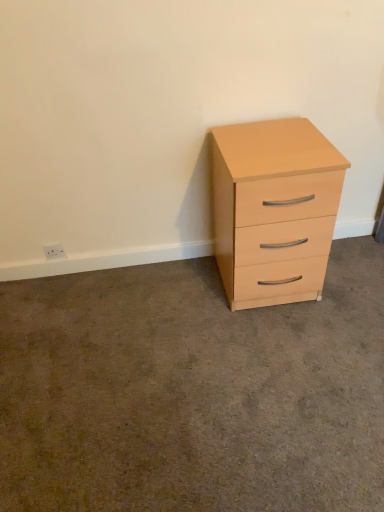
Question: Is white plastic electric outlet at lower left to the left of matte wood chest of drawers at right from the viewer's perspective?

Choices:
 (A) no
 (B) yes

Answer: (B)

Question: Is white plastic electric outlet at lower left shorter than matte wood chest of drawers at right?

Choices:
 (A) no
 (B) yes

Answer: (B)

Question: Can you confirm if white plastic electric outlet at lower left is taller than matte wood chest of drawers at right?

Choices:
 (A) no
 (B) yes

Answer: (A)

Question: Does white plastic electric outlet at lower left appear on the right side of matte wood chest of drawers at right?

Choices:
 (A) no
 (B) yes

Answer: (A)

Question: Are white plastic electric outlet at lower left and matte wood chest of drawers at right far apart?

Choices:
 (A) yes
 (B) no

Answer: (A)

Question: Is white plastic electric outlet at lower left inside or outside of matte wood cabinet at right?

Choices:
 (A) outside
 (B) inside

Answer: (A)

Question: From the image's perspective, is white plastic electric outlet at lower left above or below matte wood cabinet at right?

Choices:
 (A) above
 (B) below

Answer: (A)

Question: Is white plastic electric outlet at lower left wider or thinner than matte wood cabinet at right?

Choices:
 (A) wide
 (B) thin

Answer: (B)

Question: In the image, is white plastic electric outlet at lower left positioned in front of or behind matte wood cabinet at right?

Choices:
 (A) front
 (B) behind

Answer: (B)

Question: From a real-world perspective, is matte wood chest of drawers at right above or below white plastic electric outlet at lower left?

Choices:
 (A) above
 (B) below

Answer: (A)

Question: From the image's perspective, is matte wood chest of drawers at right located above or below white plastic electric outlet at lower left?

Choices:
 (A) above
 (B) below

Answer: (A)

Question: Choose the correct answer: Is matte wood chest of drawers at right inside white plastic electric outlet at lower left or outside it?

Choices:
 (A) outside
 (B) inside

Answer: (A)

Question: Relative to white plastic electric outlet at lower left, is matte wood chest of drawers at right in front or behind?

Choices:
 (A) front
 (B) behind

Answer: (A)

Question: Relative to matte wood chest of drawers at right, is white plastic electric outlet at lower left in front or behind?

Choices:
 (A) behind
 (B) front

Answer: (A)

Question: From the image's perspective, relative to matte wood chest of drawers at right, is white plastic electric outlet at lower left above or below?

Choices:
 (A) above
 (B) below

Answer: (B)